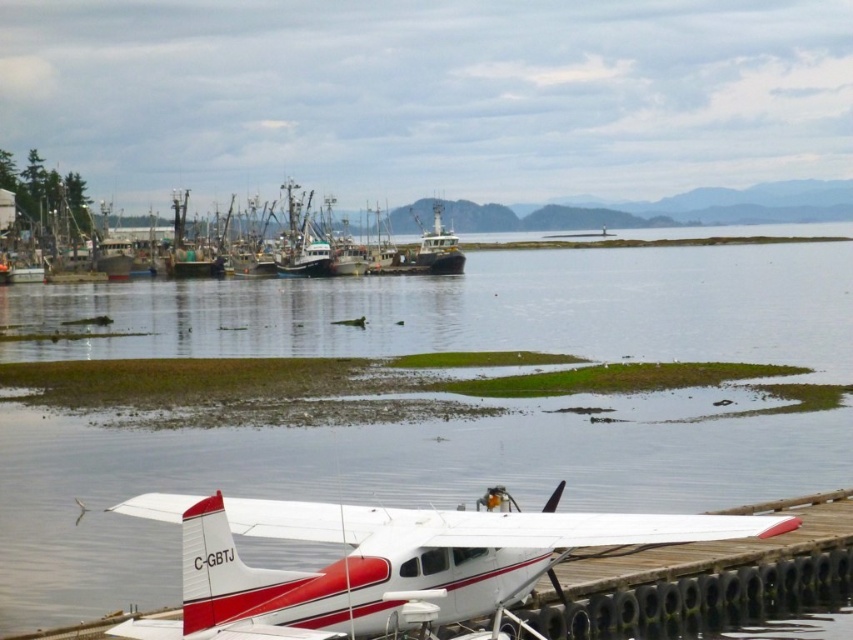
You are standing at the center of the wooden pier and want to locate the white matte airplane at lower center. According to the coordinates given, in which direction should you look to find it?

The white matte airplane at lower center is located at coordinates point (386, 561). Since the coordinate system is not specified, it is recommended to look towards the lower center direction to find the airplane.

You are a pilot preparing to take off from the clear water at center. The white matte airplane at lower center is your aircraft. Can you confirm if the water surface is high enough for your plane to safely take off?

The clear water at center has a greater height compared to the white matte airplane at lower center, so yes, the water surface is high enough for the plane to safely take off.

You are a boat operator who needs to navigate a 12 meter long vessel through the water. You see the clear water at center and the green matte fishing boat at left. Is there enough space between them for your vessel to pass safely?

The distance between the clear water at center and the green matte fishing boat at left is 15.91 meters. Since your vessel is 12 meters long, there is sufficient space to pass safely between them.